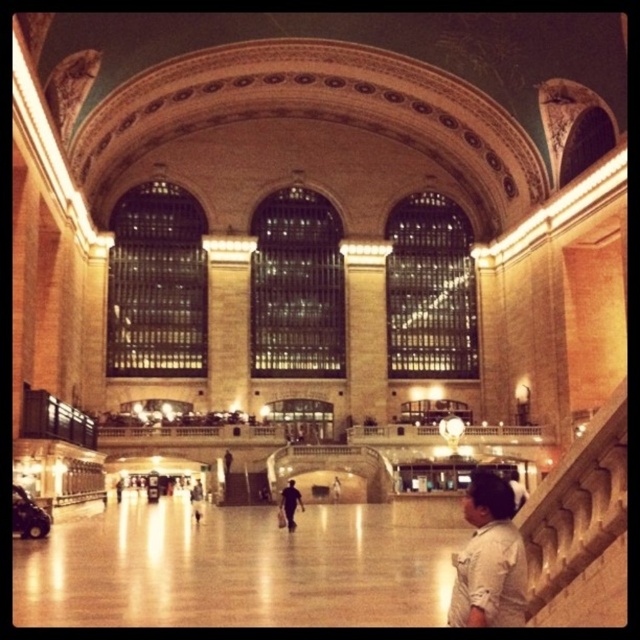
Who is taller, white cotton shirt at lower right or light blue jeans at center?

With more height is white cotton shirt at lower right.

I want to click on white cotton shirt at lower right, so click(x=488, y=557).

Does point (490, 592) lie behind point (198, 522)?

No.

This screenshot has height=640, width=640. I want to click on white cotton shirt at lower right, so click(488, 557).

Does white cotton shirt at lower right have a lesser width compared to dark blue uniform at center?

In fact, white cotton shirt at lower right might be wider than dark blue uniform at center.

At what (x,y) coordinates should I click in order to perform the action: click on white cotton shirt at lower right. Please return your answer as a coordinate pair (x, y). The width and height of the screenshot is (640, 640). Looking at the image, I should click on (488, 557).

Which is below, dark blue uniform at center or light blue jeans at center?

light blue jeans at center is below.

Is point (284, 513) farther from camera compared to point (196, 483)?

That is False.

Who is more distant from viewer, (285, 484) or (193, 515)?

Positioned behind is point (285, 484).

Find the location of a particular element. This screenshot has width=640, height=640. dark blue uniform at center is located at coordinates (291, 502).